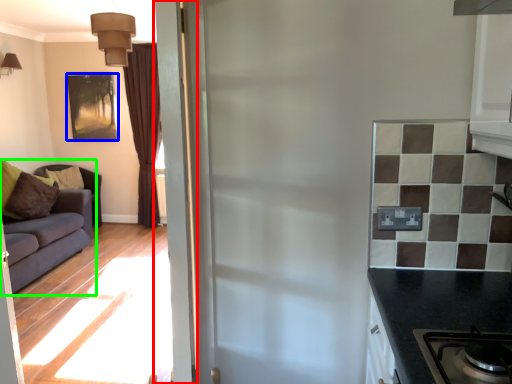
Question: Estimate the real-world distances between objects in this image. Which object is closer to door (highlighted by a red box), picture frame (highlighted by a blue box) or studio couch (highlighted by a green box)?

Choices:
 (A) picture frame
 (B) studio couch

Answer: (B)